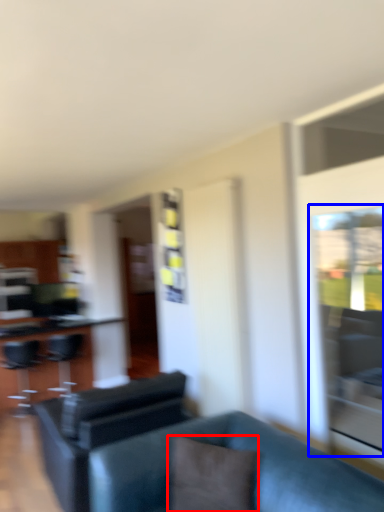
Question: Which point is further to the camera, pillow (highlighted by a red box) or glass door (highlighted by a blue box)?

Choices:
 (A) pillow
 (B) glass door

Answer: (B)